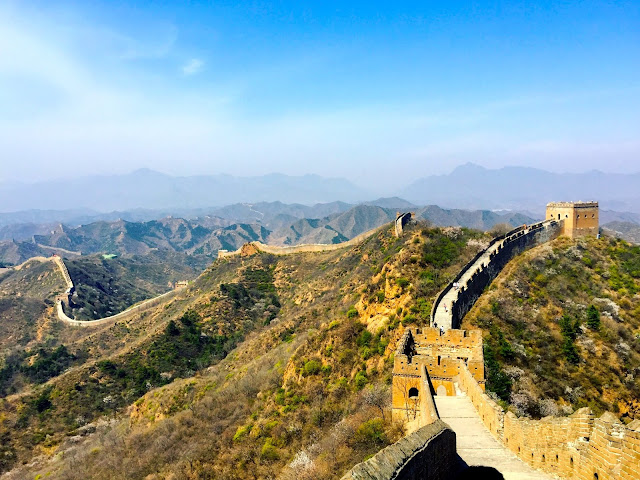
You are a GUI agent. You are given a task and a screenshot of the screen. Output one action in this format:
    pyautogui.click(x=<x>, y=<y>)
    Task: Click on the ridges in wall
    
    Given the screenshot: What is the action you would take?
    tap(605, 414), tap(582, 409), tap(467, 281)